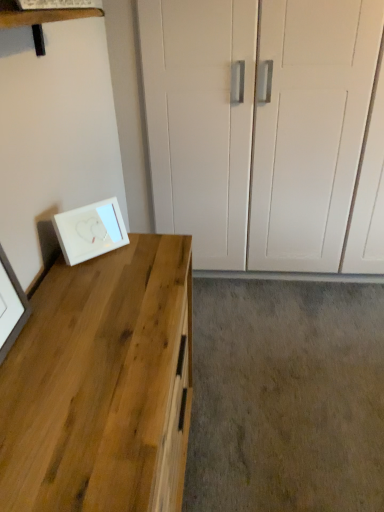
Question: Can you confirm if natural wood desk at left is shorter than white glossy picture frame at lower left?

Choices:
 (A) yes
 (B) no

Answer: (B)

Question: Does natural wood desk at left contain white glossy picture frame at lower left?

Choices:
 (A) yes
 (B) no

Answer: (B)

Question: From a real-world perspective, is natural wood desk at left under white glossy picture frame at lower left?

Choices:
 (A) yes
 (B) no

Answer: (A)

Question: Does natural wood desk at left touch white glossy picture frame at lower left?

Choices:
 (A) yes
 (B) no

Answer: (B)

Question: From the image's perspective, would you say natural wood desk at left is positioned over white glossy picture frame at lower left?

Choices:
 (A) yes
 (B) no

Answer: (B)

Question: Can you confirm if natural wood desk at left is bigger than white glossy picture frame at lower left?

Choices:
 (A) yes
 (B) no

Answer: (A)

Question: Is white glossy picture frame at lower left smaller than natural wood desk at left?

Choices:
 (A) no
 (B) yes

Answer: (B)

Question: Is white glossy picture frame at lower left shorter than natural wood desk at left?

Choices:
 (A) no
 (B) yes

Answer: (B)

Question: Would you say white glossy picture frame at lower left contains natural wood desk at left?

Choices:
 (A) no
 (B) yes

Answer: (A)

Question: Can you confirm if white glossy picture frame at lower left is wider than natural wood desk at left?

Choices:
 (A) no
 (B) yes

Answer: (A)

Question: Is white glossy picture frame at lower left to the left of natural wood desk at left from the viewer's perspective?

Choices:
 (A) yes
 (B) no

Answer: (A)

Question: From the image's perspective, is white glossy picture frame at lower left beneath natural wood desk at left?

Choices:
 (A) yes
 (B) no

Answer: (B)

Question: From the image's perspective, is natural wood desk at left above or below white glossy picture frame at lower left?

Choices:
 (A) above
 (B) below

Answer: (B)